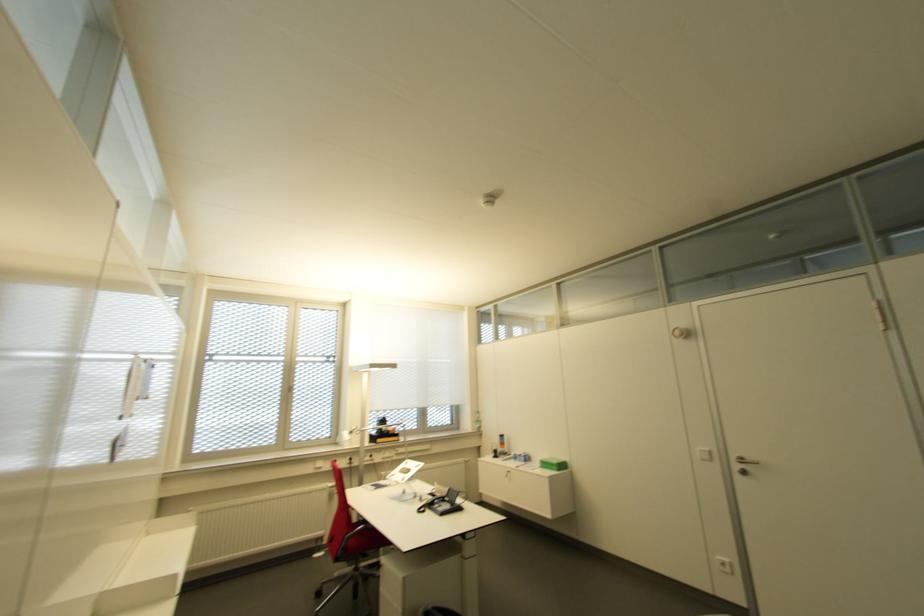
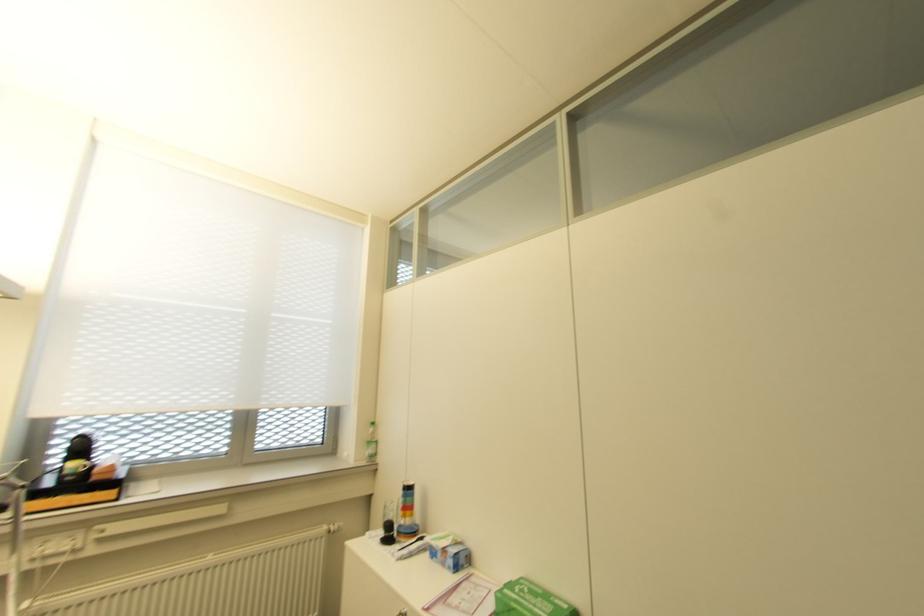
Find the pixel in the second image that matches (517,456) in the first image.

(441, 549)